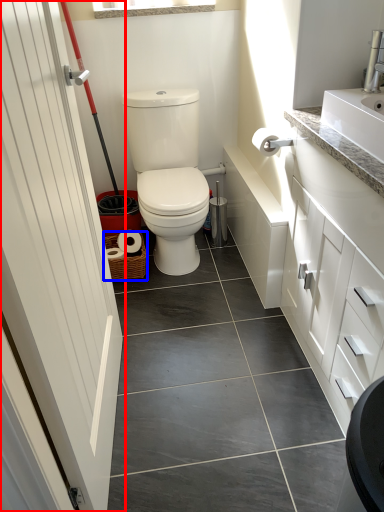
Question: Which object appears farthest to the camera in this image, door (highlighted by a red box) or basket (highlighted by a blue box)?

Choices:
 (A) door
 (B) basket

Answer: (B)